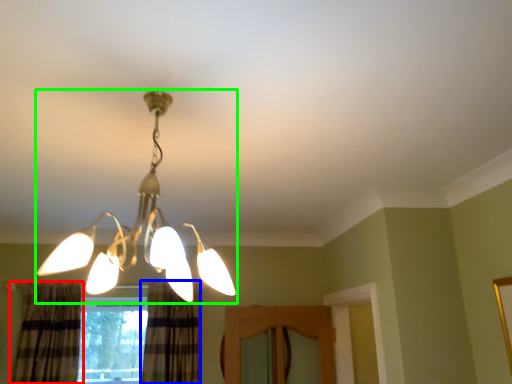
Question: Which object is positioned closest to curtain (highlighted by a red box)? Select from curtain (highlighted by a blue box) and lamp (highlighted by a green box).

Choices:
 (A) curtain
 (B) lamp

Answer: (A)